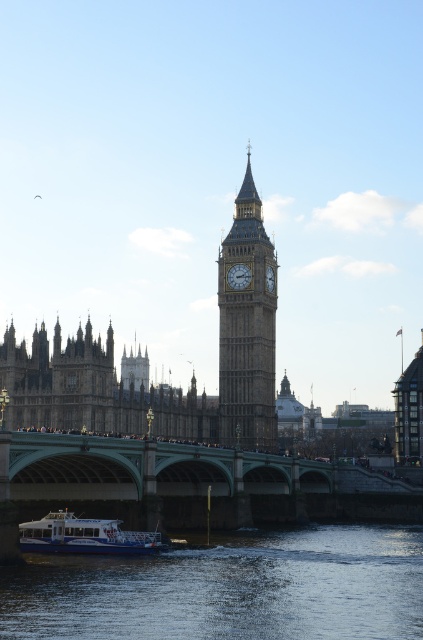
You are a tourist standing on the green bridge and looking down at the blue water at lower center and the white glossy boat at lower left. Which object appears taller from your viewpoint?

The blue water at lower center appears taller than the white glossy boat at lower left from your viewpoint.

You are a tourist holding a camera and want to take a photo of both the golden stone clock tower at center and the matte gold clock at center. Which object should you focus on first if you want to capture both in the frame without moving the camera?

You should focus on the golden stone clock tower at center first because it is taller than the matte gold clock at center, allowing it to fit within the frame more easily when positioned centrally.